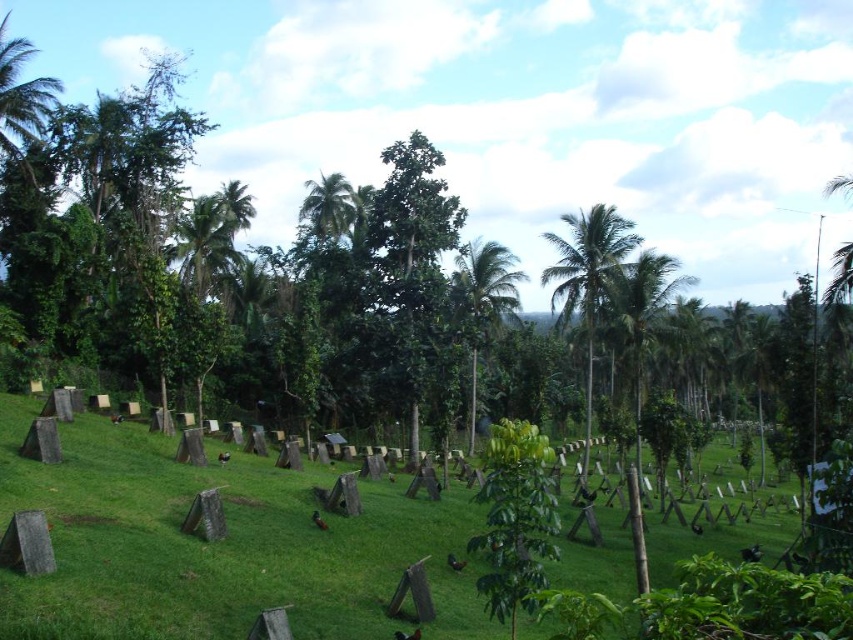
Does point (38, 404) come closer to viewer compared to point (585, 212)?

Yes, point (38, 404) is closer to viewer.

Which is in front, point (302, 536) or point (602, 273)?

Positioned in front is point (302, 536).

Where is `green grass at center`? The image size is (853, 640). green grass at center is located at coordinates [x=219, y=545].

Is green grass at center to the right of green leafy palm tree at center from the viewer's perspective?

No, green grass at center is not to the right of green leafy palm tree at center.

Who is more forward, (331, 566) or (488, 241)?

Point (331, 566)

Find the location of a particular element. The image size is (853, 640). green grass at center is located at coordinates (219, 545).

Who is more distant from viewer, (587, 296) or (479, 300)?

Positioned behind is point (479, 300).

Does green leafy palm tree at center-right have a smaller size compared to green leafy palm tree at center?

No, green leafy palm tree at center-right is not smaller than green leafy palm tree at center.

The width and height of the screenshot is (853, 640). What are the coordinates of `green leafy palm tree at center-right` in the screenshot? It's located at (587, 278).